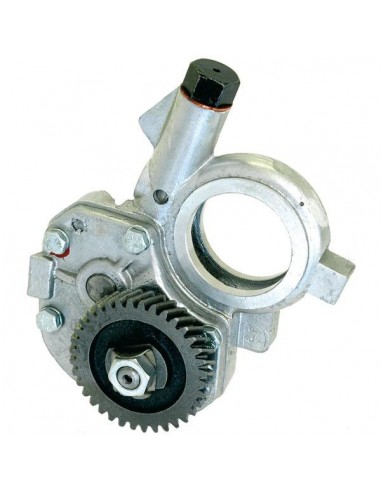
Where is `washer`? Image resolution: width=381 pixels, height=492 pixels. washer is located at coordinates (158, 364), (59, 315), (64, 237), (145, 232).